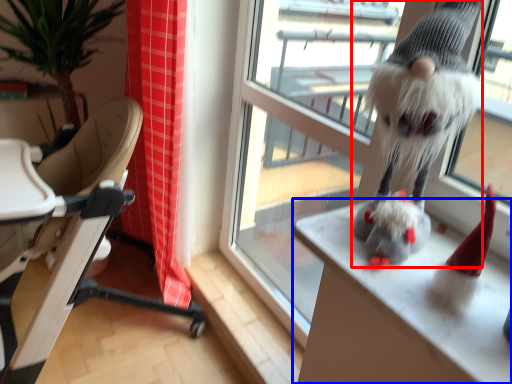
Question: Which object is further to the camera taking this photo, animal (highlighted by a red box) or desk (highlighted by a blue box)?

Choices:
 (A) animal
 (B) desk

Answer: (B)